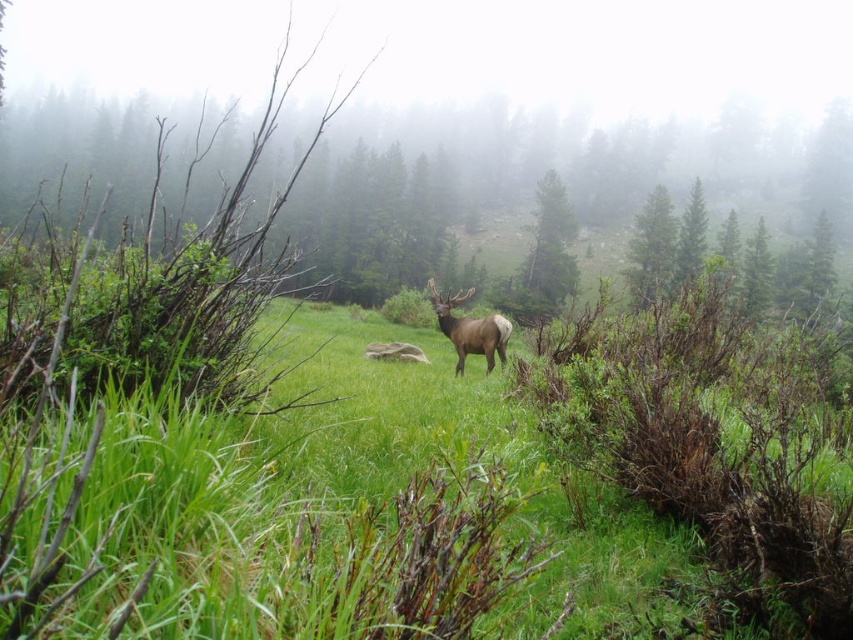
You are a hiker in the forest and want to take a clear photo of the elk without any obstruction. Which object between the green grassy at center and the green leafy tree at upper center is better to stand behind for a clearer view?

The green grassy at center is shorter than the green leafy tree at upper center, so standing behind the green grassy at center would provide a clearer view of the elk since it is shorter and less likely to block the sightline.

You are a wildlife photographer aiming to capture both the green grassy at center and the brown velvet deer at center in a single frame. Based on their sizes, which one should you focus on to ensure both fit clearly in the photo?

The green grassy at center is smaller than the brown velvet deer at center, so focusing on the brown velvet deer at center would allow the smaller green grassy at center to also fit clearly in the photo.

You are standing in the misty forest scene and want to move from the point closer to you to the point further away. Which path would you take between the two points, point (x=424, y=385) and point (x=630, y=292)?

You should take the path from point (x=424, y=385) to point (x=630, y=292) since point (x=424, y=385) is closer to the viewer and you want to move to the point further away.